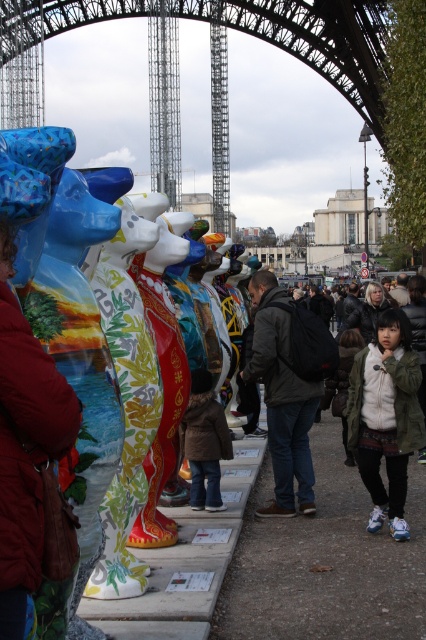
Question: In this image, where is matte olive green jacket at lower right located relative to metallic gray lattice at center?

Choices:
 (A) above
 (B) below

Answer: (B)

Question: Which of the following is the farthest from the observer?

Choices:
 (A) (284, 362)
 (B) (147, 19)
 (C) (218, 54)

Answer: (B)

Question: Which object is the closest to the matte olive green jacket at lower right?

Choices:
 (A) brown fuzzy coat at center
 (B) dark gray backpack at center

Answer: (B)

Question: Which of the following is the closest to the observer?

Choices:
 (A) (158, 22)
 (B) (386, 496)
 (C) (181, 436)

Answer: (B)

Question: Is matte olive green jacket at lower right positioned in front of metallic gray lattice at center?

Choices:
 (A) no
 (B) yes

Answer: (B)

Question: Does matte red coat at center come behind brushed metal eiffel tower at center?

Choices:
 (A) no
 (B) yes

Answer: (A)